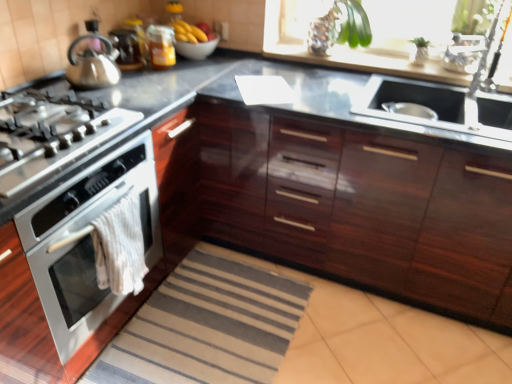
Question: Can you confirm if satin silver gas stove at left is wider than white towel at lower left?

Choices:
 (A) no
 (B) yes

Answer: (B)

Question: Is satin silver gas stove at left smaller than white towel at lower left?

Choices:
 (A) yes
 (B) no

Answer: (B)

Question: Can you confirm if satin silver gas stove at left is taller than white towel at lower left?

Choices:
 (A) no
 (B) yes

Answer: (A)

Question: Is white towel at lower left a part of satin silver gas stove at left?

Choices:
 (A) yes
 (B) no

Answer: (B)

Question: Is satin silver gas stove at left directly adjacent to white towel at lower left?

Choices:
 (A) yes
 (B) no

Answer: (B)

Question: Is satin silver gas stove at left facing towards white towel at lower left?

Choices:
 (A) yes
 (B) no

Answer: (B)

Question: Is yellow matte bananas at upper center next to shiny metallic kettle at upper left and touching it?

Choices:
 (A) no
 (B) yes

Answer: (A)

Question: Is yellow matte bananas at upper center positioned beyond the bounds of shiny metallic kettle at upper left?

Choices:
 (A) no
 (B) yes

Answer: (B)

Question: Is shiny metallic kettle at upper left inside yellow matte bananas at upper center?

Choices:
 (A) no
 (B) yes

Answer: (A)

Question: Is yellow matte bananas at upper center wider than shiny metallic kettle at upper left?

Choices:
 (A) yes
 (B) no

Answer: (B)

Question: Can you confirm if yellow matte bananas at upper center is positioned to the right of shiny metallic kettle at upper left?

Choices:
 (A) yes
 (B) no

Answer: (A)

Question: Can you confirm if yellow matte bananas at upper center is thinner than shiny metallic kettle at upper left?

Choices:
 (A) yes
 (B) no

Answer: (A)

Question: Is satin nickel faucet at upper right facing away from yellow matte bananas at upper center?

Choices:
 (A) no
 (B) yes

Answer: (A)